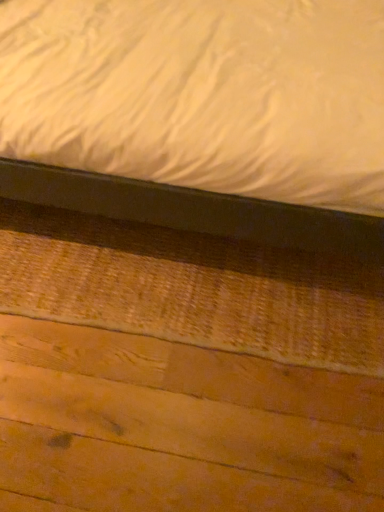
What are the coordinates of `matte black bed at upper center` in the screenshot? It's located at (192, 209).

This screenshot has width=384, height=512. What do you see at coordinates (192, 209) in the screenshot?
I see `matte black bed at upper center` at bounding box center [192, 209].

Identify the location of matte black bed at upper center. Image resolution: width=384 pixels, height=512 pixels. (192, 209).